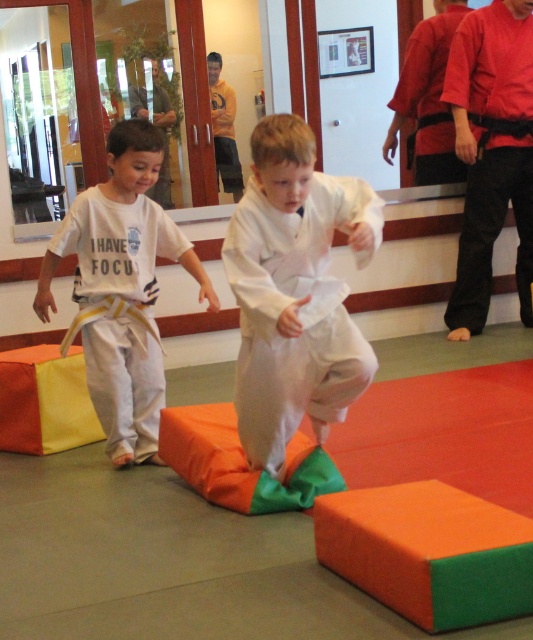
Question: Does white cotton kimono at center have a lesser width compared to yellow belt at left?

Choices:
 (A) yes
 (B) no

Answer: (A)

Question: Is white cotton kimono at center to the left of yellow belt at left from the viewer's perspective?

Choices:
 (A) yes
 (B) no

Answer: (B)

Question: Which point is closer to the camera?

Choices:
 (A) white cotton kimono at center
 (B) yellow belt at left

Answer: (A)

Question: Can you confirm if white cotton kimono at center is positioned to the right of yellow belt at left?

Choices:
 (A) yes
 (B) no

Answer: (A)

Question: Which of the following is the closest to the observer?

Choices:
 (A) yellow belt at left
 (B) white cotton kimono at center

Answer: (B)